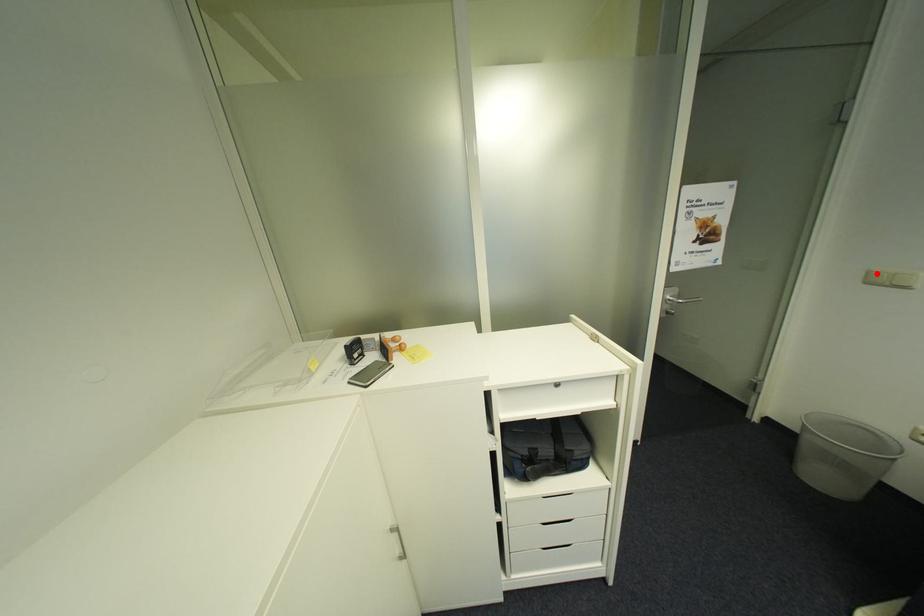
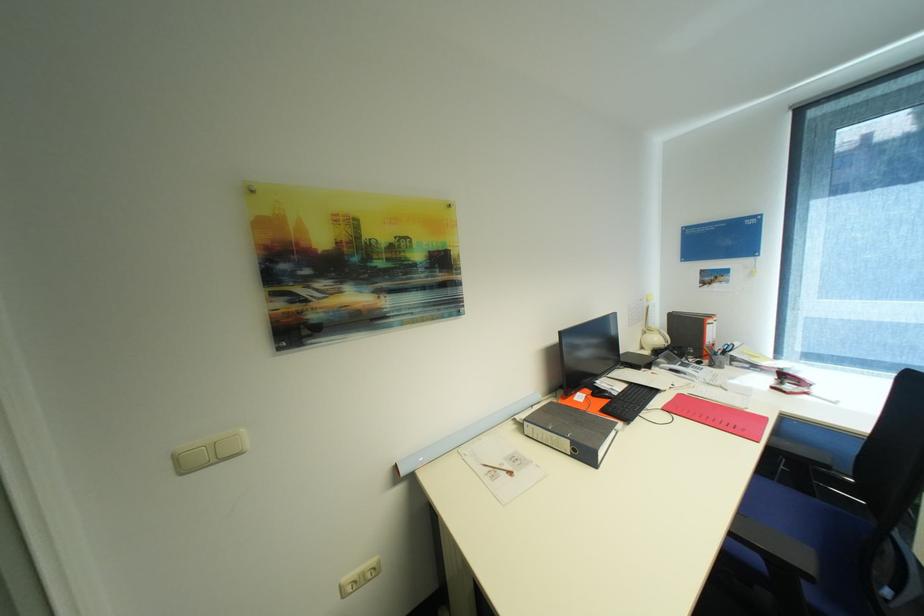
Question: A red point is marked in image1. In image2, is the corresponding 3D point closer to the camera or farther? Reply with the corresponding letter.

Choices:
 (A) The corresponding 3D point is closer.
 (B) The corresponding 3D point is farther.

Answer: (A)